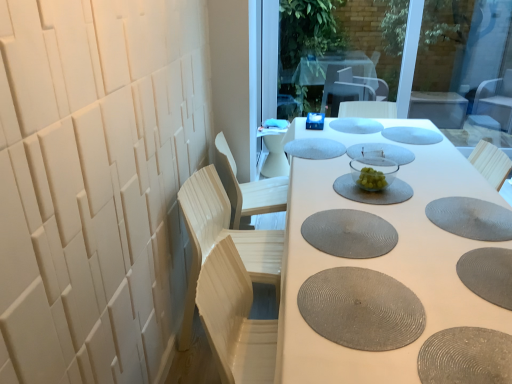
I want to click on free space between gray textured placemat at lower right, the 6th manhole cover in the back-to-front sequence, and clear glass bowl at center, which is the fourth manhole cover in back-to-front order, so click(419, 178).